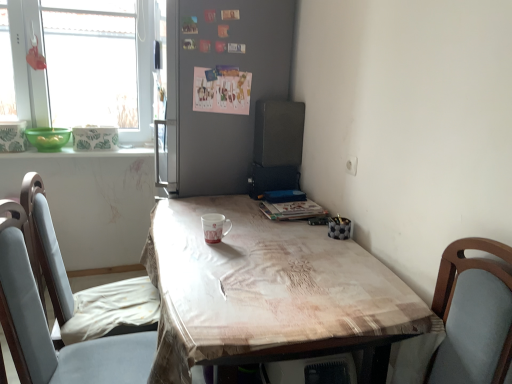
At what (x,y) coordinates should I click in order to perform the action: click on vacant point above black matte speaker at upper right (from a real-world perspective). Please return your answer as a coordinate pair (x, y). The image size is (512, 384). Looking at the image, I should click on (282, 100).